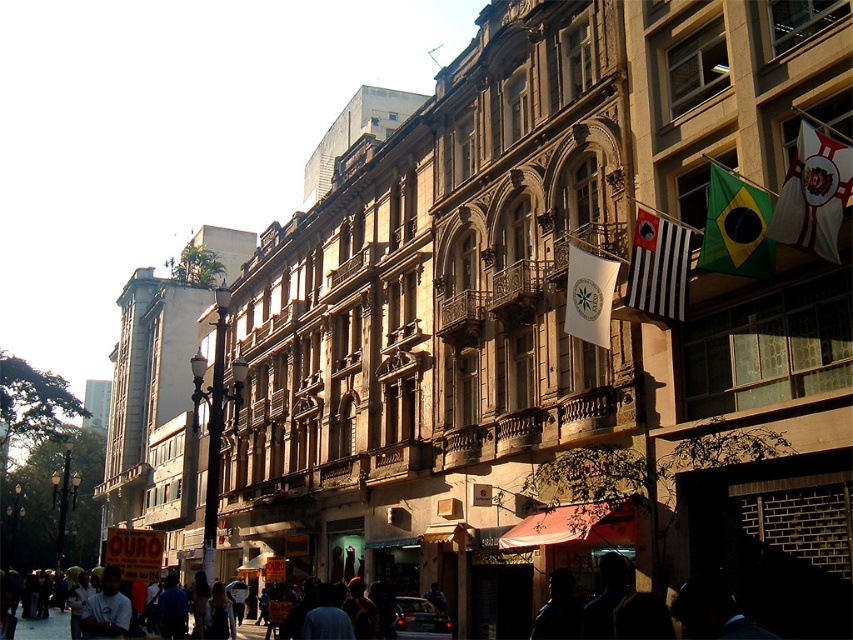
In the scene shown: Who is positioned more to the left, light blue shirt at lower left or dark gray fabric crowd at center?

dark gray fabric crowd at center is more to the left.

This screenshot has width=853, height=640. What do you see at coordinates (106, 609) in the screenshot? I see `light blue shirt at lower left` at bounding box center [106, 609].

At what (x,y) coordinates should I click in order to perform the action: click on light blue shirt at lower left. Please return your answer as a coordinate pair (x, y). Looking at the image, I should click on (106, 609).

Who is more forward, (576, 608) or (53, 609)?

Positioned in front is point (576, 608).

Is point (555, 608) closer to camera compared to point (245, 627)?

Yes, it is.

Find the location of `silhouette of person at center`. silhouette of person at center is located at coordinates (558, 609).

Between silhouette figure at center and dark gray fabric crowd at center, which one is positioned higher?

silhouette figure at center

Is point (616, 580) in front of point (27, 620)?

Yes, point (616, 580) is in front of point (27, 620).

Is point (587, 636) closer to camera compared to point (20, 620)?

Yes, point (587, 636) is in front of point (20, 620).

Locate an element on the screen. The image size is (853, 640). silhouette figure at center is located at coordinates (606, 596).